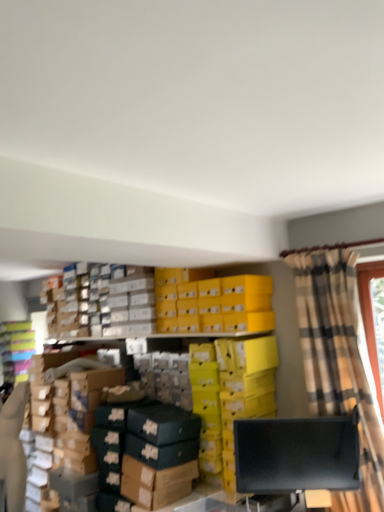
Identify the location of plaid fabric curtain at right. (338, 360).

Identify the location of matte plastic shoebox at left. This screenshot has height=512, width=384. pos(16,349).

This screenshot has height=512, width=384. Describe the element at coordinates (296, 455) in the screenshot. I see `black matte monitor at lower right` at that location.

The image size is (384, 512). I want to click on plaid fabric curtain at right, so click(x=338, y=360).

From a real-world perspective, is matte plastic shoebox at left above or below plaid fabric curtain at right?

From a real-world perspective, matte plastic shoebox at left is physically above plaid fabric curtain at right.

Relative to plaid fabric curtain at right, is matte plastic shoebox at left in front or behind?

Clearly, matte plastic shoebox at left is behind plaid fabric curtain at right.

Considering the positions of objects matte plastic shoebox at left and plaid fabric curtain at right in the image provided, who is more to the right, matte plastic shoebox at left or plaid fabric curtain at right?

Positioned to the right is plaid fabric curtain at right.

Where is `curtain on the right of matte plastic shoebox at left`? The image size is (384, 512). curtain on the right of matte plastic shoebox at left is located at coordinates (338, 360).

Is black matte monitor at lower right taller or shorter than plaid fabric curtain at right?

Considering their sizes, black matte monitor at lower right has less height than plaid fabric curtain at right.

Does point (310, 450) come in front of point (285, 255)?

Yes.

Visually, is black matte monitor at lower right positioned to the left or to the right of plaid fabric curtain at right?

black matte monitor at lower right is to the left of plaid fabric curtain at right.

In the scene shown: From a real-world perspective, is black matte monitor at lower right beneath plaid fabric curtain at right?

Yes.

Can you confirm if matte plastic shoebox at left is thinner than black matte monitor at lower right?

In fact, matte plastic shoebox at left might be wider than black matte monitor at lower right.

Who is bigger, matte plastic shoebox at left or black matte monitor at lower right?

Bigger between the two is matte plastic shoebox at left.

Between matte plastic shoebox at left and black matte monitor at lower right, which one appears on the left side from the viewer's perspective?

Positioned to the left is matte plastic shoebox at left.

Is black matte monitor at lower right turned away from matte plastic shoebox at left?

No, black matte monitor at lower right is not facing the opposite direction of matte plastic shoebox at left.

Consider the image. How different are the orientations of black matte monitor at lower right and matte plastic shoebox at left in degrees?

They differ by 40.6 degrees in their facing directions.

Which of these two, black matte monitor at lower right or matte plastic shoebox at left, is thinner?

With smaller width is black matte monitor at lower right.

Considering the relative sizes of black matte monitor at lower right and matte plastic shoebox at left in the image provided, is black matte monitor at lower right taller than matte plastic shoebox at left?

No.

From a real-world perspective, who is located higher, plaid fabric curtain at right or black matte monitor at lower right?

From a 3D spatial view, plaid fabric curtain at right is above.

Which of these two, plaid fabric curtain at right or black matte monitor at lower right, is bigger?

plaid fabric curtain at right is bigger.

Considering the relative sizes of plaid fabric curtain at right and black matte monitor at lower right in the image provided, is plaid fabric curtain at right taller than black matte monitor at lower right?

Yes, plaid fabric curtain at right is taller than black matte monitor at lower right.

Identify the location of shelf behind the plaid fabric curtain at right. The height and width of the screenshot is (512, 384). (16, 349).

Which is behind, point (340, 372) or point (23, 334)?

The point (23, 334) is farther.

Is matte plastic shoebox at left at the back of plaid fabric curtain at right?

plaid fabric curtain at right is not turned away from matte plastic shoebox at left.

Is plaid fabric curtain at right next to matte plastic shoebox at left?

They are not placed beside each other.

Locate an element on the screen. shelf above the plaid fabric curtain at right (from a real-world perspective) is located at coordinates (16, 349).

Where is `curtain in front of the black matte monitor at lower right`? This screenshot has width=384, height=512. curtain in front of the black matte monitor at lower right is located at coordinates (338, 360).

Estimate the real-world distances between objects in this image. Which object is closer to plaid fabric curtain at right, black matte monitor at lower right or matte plastic shoebox at left?

black matte monitor at lower right is closer to plaid fabric curtain at right.

Which object lies nearer to the anchor point matte plastic shoebox at left, plaid fabric curtain at right or black matte monitor at lower right?

black matte monitor at lower right.

When comparing their distances from black matte monitor at lower right, does matte plastic shoebox at left or plaid fabric curtain at right seem closer?

plaid fabric curtain at right is positioned closer to the anchor black matte monitor at lower right.

Considering their positions, is plaid fabric curtain at right positioned closer to black matte monitor at lower right than matte plastic shoebox at left?

Among the two, plaid fabric curtain at right is located nearer to black matte monitor at lower right.

Based on their spatial positions, is matte plastic shoebox at left or black matte monitor at lower right closer to plaid fabric curtain at right?

black matte monitor at lower right lies closer to plaid fabric curtain at right than the other object.

When comparing their distances from matte plastic shoebox at left, does black matte monitor at lower right or plaid fabric curtain at right seem closer?

black matte monitor at lower right lies closer to matte plastic shoebox at left than the other object.

Identify the location of computer monitor between matte plastic shoebox at left and plaid fabric curtain at right in the horizontal direction. (296, 455).